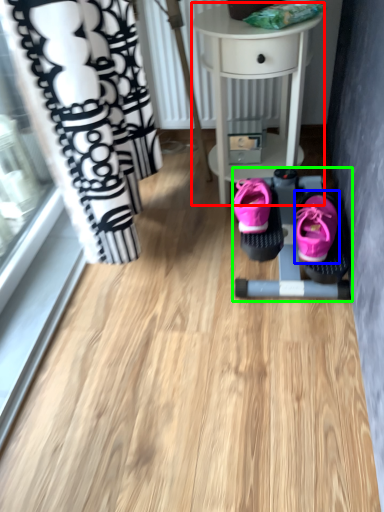
Question: Based on their relative distances, which object is nearer to table (highlighted by a red box)? Choose from footwear (highlighted by a blue box) and baby carriage (highlighted by a green box).

Choices:
 (A) footwear
 (B) baby carriage

Answer: (B)